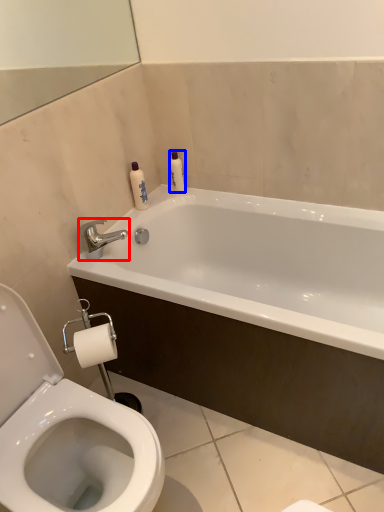
Question: Among these objects, which one is nearest to the camera, tap (highlighted by a red box) or toiletry (highlighted by a blue box)?

Choices:
 (A) tap
 (B) toiletry

Answer: (A)